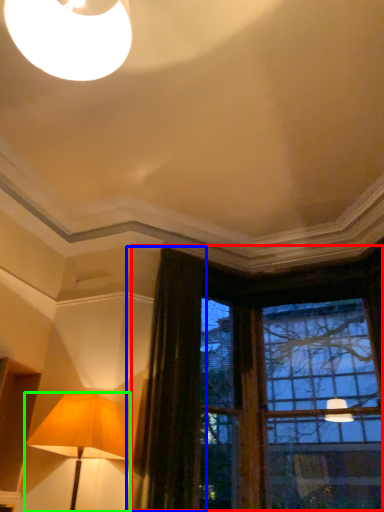
Question: Estimate the real-world distances between objects in this image. Which object is closer to window (highlighted by a red box), curtain (highlighted by a blue box) or lamp (highlighted by a green box)?

Choices:
 (A) curtain
 (B) lamp

Answer: (A)